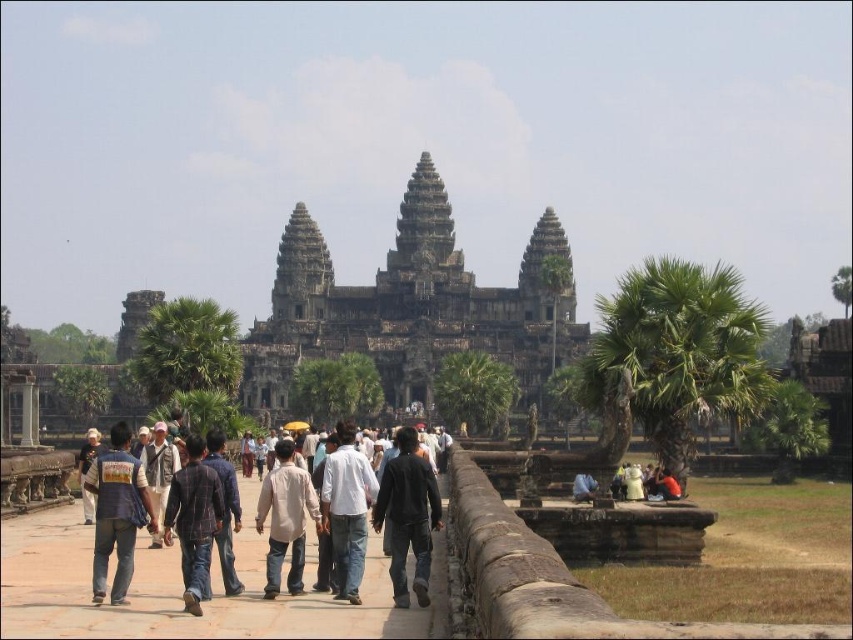
Question: Can you confirm if dark gray stone hindu temple at center is wider than denim jacket at lower left?

Choices:
 (A) no
 (B) yes

Answer: (B)

Question: Which object is farther from the camera taking this photo?

Choices:
 (A) dark gray stone hindu temple at center
 (B) denim jacket at lower left
 (C) light brown cotton shirt at center

Answer: (A)

Question: Which object is positioned farthest from the plaid shirt at center?

Choices:
 (A) dark gray stone hindu temple at center
 (B) denim jacket at lower left

Answer: (A)

Question: Is denim jacket at lower left smaller than plaid shirt at center?

Choices:
 (A) no
 (B) yes

Answer: (A)

Question: Based on their relative distances, which object is farther from the light brown cotton shirt at center?

Choices:
 (A) dark gray stone hindu temple at center
 (B) denim jacket at lower left

Answer: (A)

Question: Is dark gray stone hindu temple at center below plaid shirt at center?

Choices:
 (A) no
 (B) yes

Answer: (A)